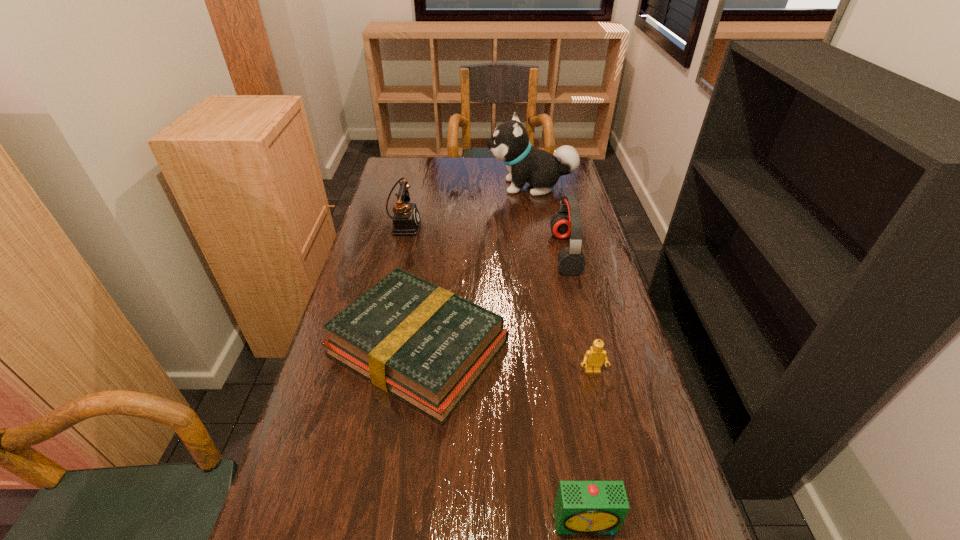
Identify the location of vacant space that satisfies the following two spatial constraints: 1. on the ear cups of the earphone; 2. on the front-facing side of the alarm clock. point(629,522).

At what (x,y) coordinates should I click in order to perform the action: click on free spot that satisfies the following two spatial constraints: 1. on the front of the telephone at the rotary dial; 2. on the right side of the hardback book. Please return your answer as a coordinate pair (x, y). This screenshot has width=960, height=540. Looking at the image, I should click on (375, 348).